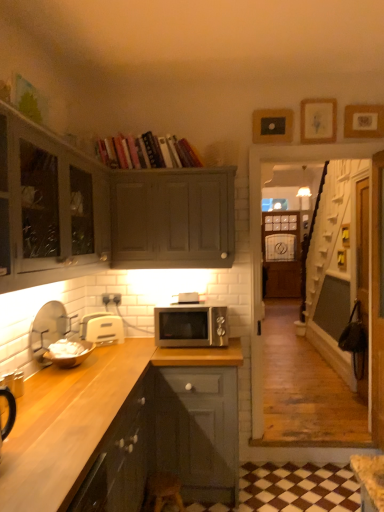
Question: From a real-world perspective, is matte gray cabinet at upper center, which ranks as the 1th cabinetry in top-to-bottom order, positioned above or below hardcover books at upper center?

Choices:
 (A) below
 (B) above

Answer: (A)

Question: Relative to hardcover books at upper center, is matte gray cabinet at upper center, which ranks as the 1th cabinetry in top-to-bottom order, in front or behind?

Choices:
 (A) front
 (B) behind

Answer: (A)

Question: Based on their relative distances, which object is nearer to the satin silver microwave at center?

Choices:
 (A) dark wood countertop at lower left, placed as the third cabinetry when sorted from top to bottom
 (B) matte gray cabinet at upper left, which appears as the 2th cabinetry when viewed from the top
 (C) white matte bowl at left, the fourth appliance in the right-to-left sequence
 (D) matte gray cabinet at upper center, which ranks as the 1th cabinetry in top-to-bottom order
 (E) wooden picture frame at upper center, which appears as the second picture frame when viewed from the left

Answer: (D)

Question: Considering the real-world distances, which object is farthest from the dark wood countertop at lower left, placed as the third cabinetry when sorted from top to bottom?

Choices:
 (A) matte gray cabinet at upper left, which appears as the 2th cabinetry when viewed from the top
 (B) wooden stool at lower center
 (C) hardcover books at upper center
 (D) black matte picture frame at upper center, which appears as the third picture frame when viewed from the right
 (E) silver metallic microwave at center, the fourth appliance in the left-to-right sequence

Answer: (D)